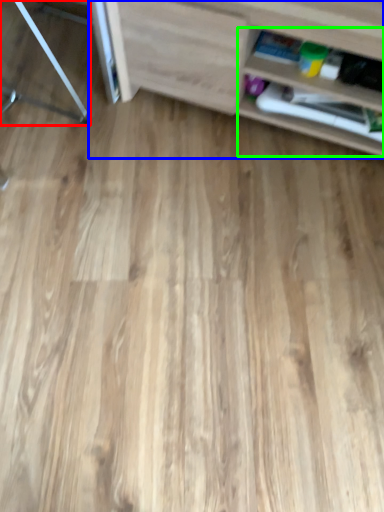
Question: Which object is positioned farthest from furniture (highlighted by a red box)? Select from shelf (highlighted by a blue box) and shelf (highlighted by a green box).

Choices:
 (A) shelf
 (B) shelf

Answer: (B)